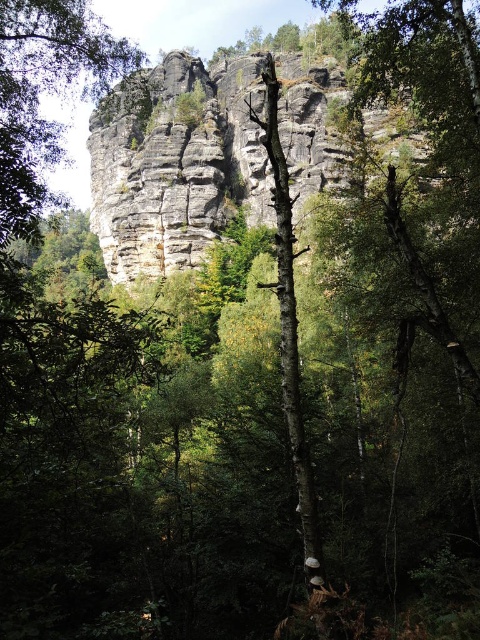
Is gray rock formation at center wider than rough textured rock at upper center?

Indeed, gray rock formation at center has a greater width compared to rough textured rock at upper center.

Who is taller, gray rock formation at center or rough textured rock at upper center?

Standing taller between the two is gray rock formation at center.

The width and height of the screenshot is (480, 640). I want to click on gray rock formation at center, so (x=177, y=164).